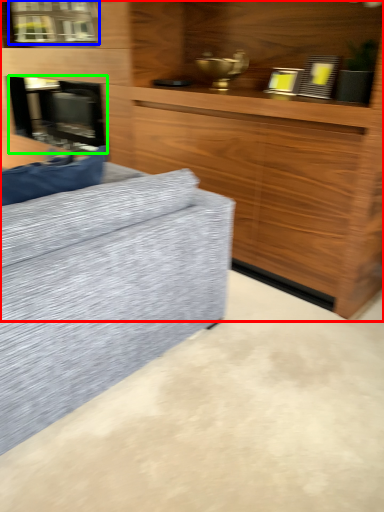
Question: Which object is positioned closest to cabinetry (highlighted by a red box)? Select from window (highlighted by a blue box) and fireplace (highlighted by a green box).

Choices:
 (A) window
 (B) fireplace

Answer: (B)